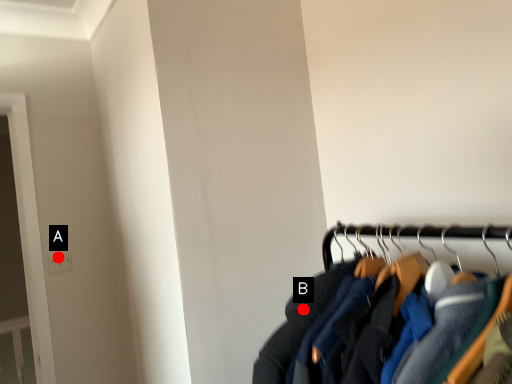
Question: Two points are circled on the image, labeled by A and B beside each circle. Which point is closer to the camera?

Choices:
 (A) A is closer
 (B) B is closer

Answer: (B)